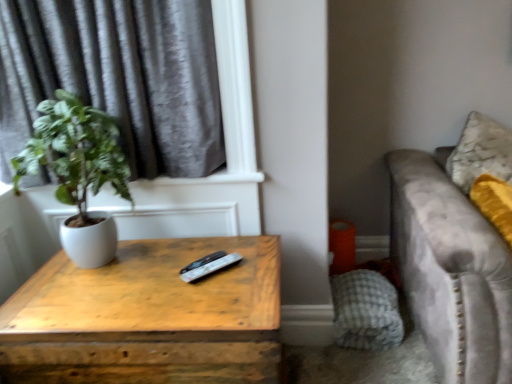
Locate an element on the screen. Image resolution: width=512 pixels, height=384 pixels. vacant space in front of black plastic remote at center is located at coordinates (192, 301).